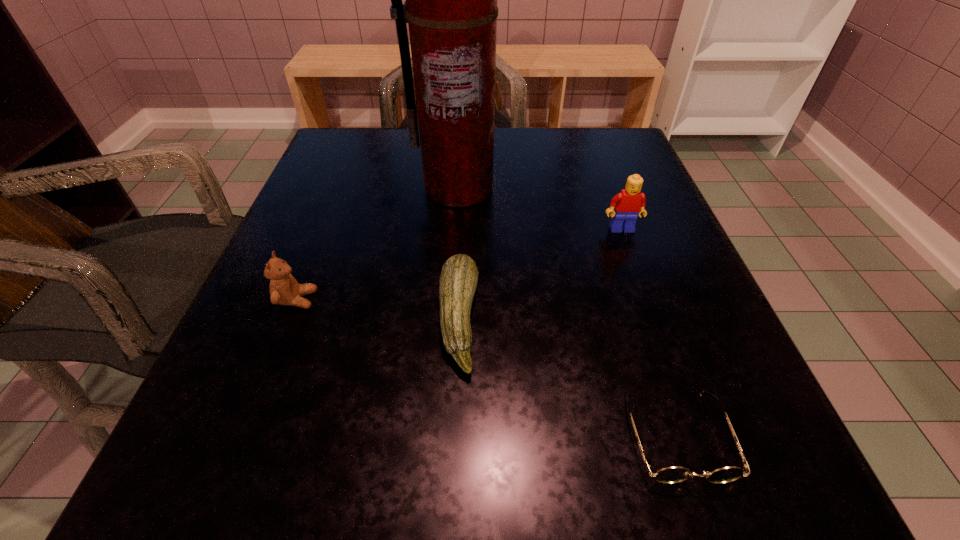
Locate an element on the screen. The image size is (960, 540). vacant space in between the nearest object and the Lego is located at coordinates (650, 332).

Find the location of `free area in between the Lego and the second shortest object`. free area in between the Lego and the second shortest object is located at coordinates (540, 274).

Choose which object is the fourth nearest neighbor to the fourth tallest object. Please provide its 2D coordinates. Your answer should be formatted as a tuple, i.e. [(x, y)], where the tuple contains the x and y coordinates of a point satisfying the conditions above.

[(628, 204)]

Find the location of `object that can be found as the fourth closest to the leftmost object`. object that can be found as the fourth closest to the leftmost object is located at coordinates (628, 204).

Find the location of a particular element. Image resolution: width=960 pixels, height=540 pixels. free space that satisfies the following two spatial constraints: 1. on the face of the second tallest object; 2. at the stem end of the zucchini is located at coordinates (655, 320).

Image resolution: width=960 pixels, height=540 pixels. I want to click on free space in the image that satisfies the following two spatial constraints: 1. on the side of the farthest object with the handle and hose; 2. on the face of the third shortest object, so click(x=450, y=300).